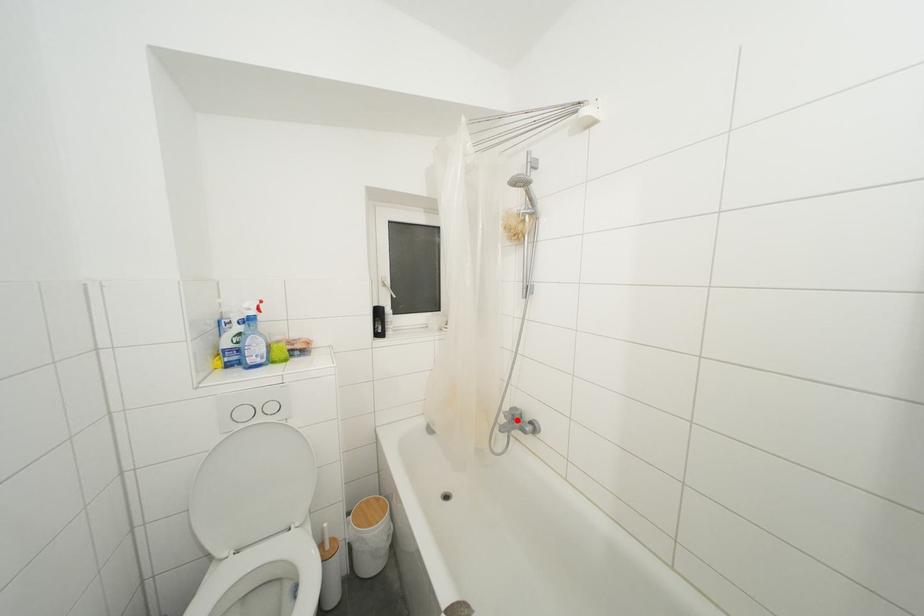
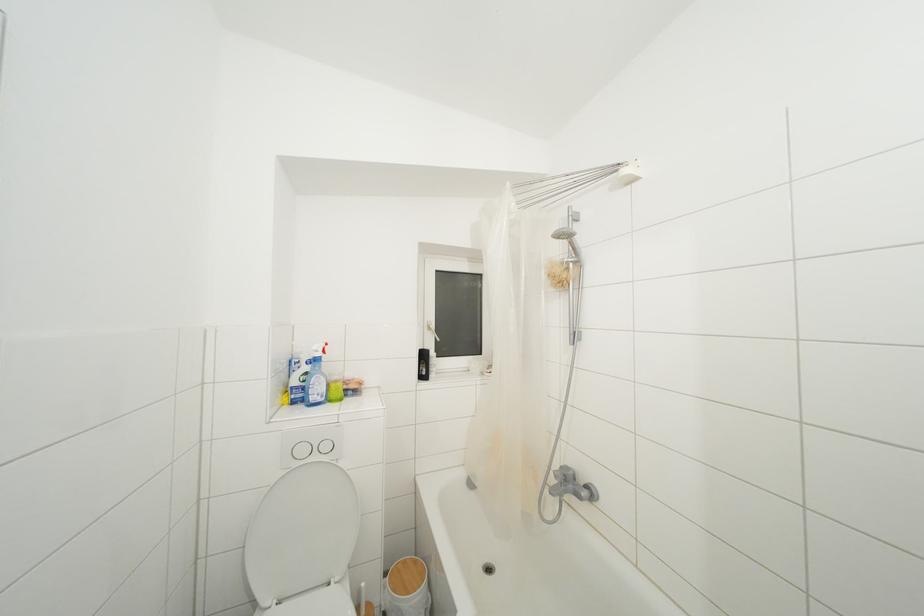
Find the pixel in the second image that matches the highlighted location in the first image.

(568, 480)